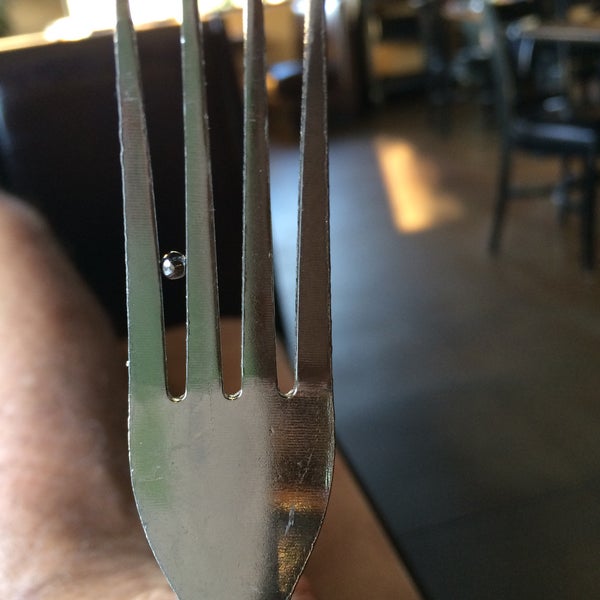
Where is `chair`? This screenshot has height=600, width=600. chair is located at coordinates (553, 135).